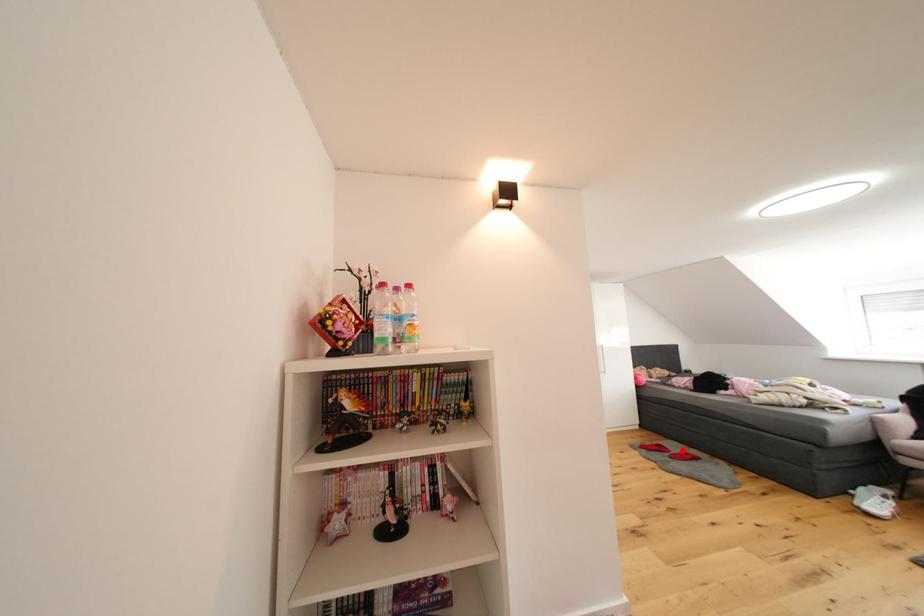
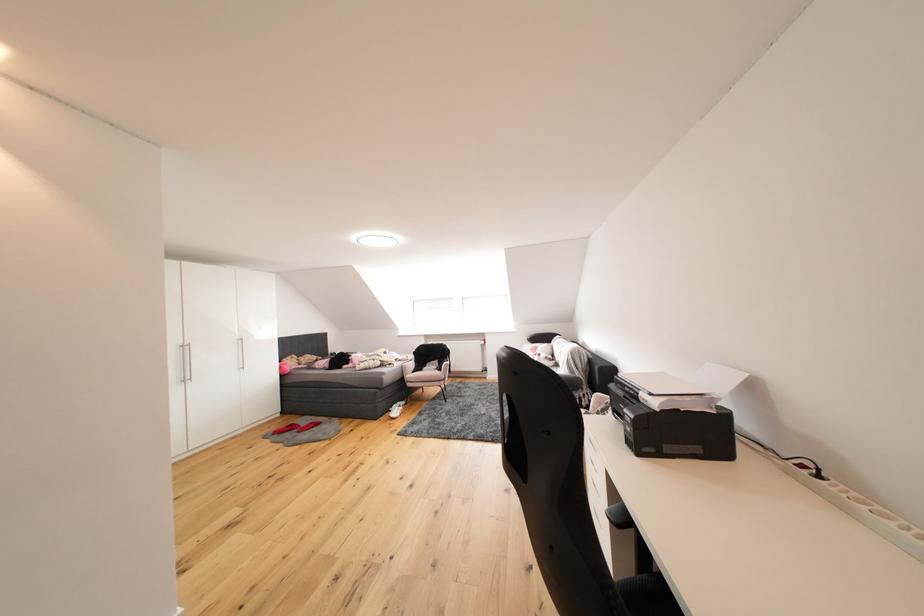
Where in the second image is the point corresponding to the highlighted location from the first image?

(313, 424)